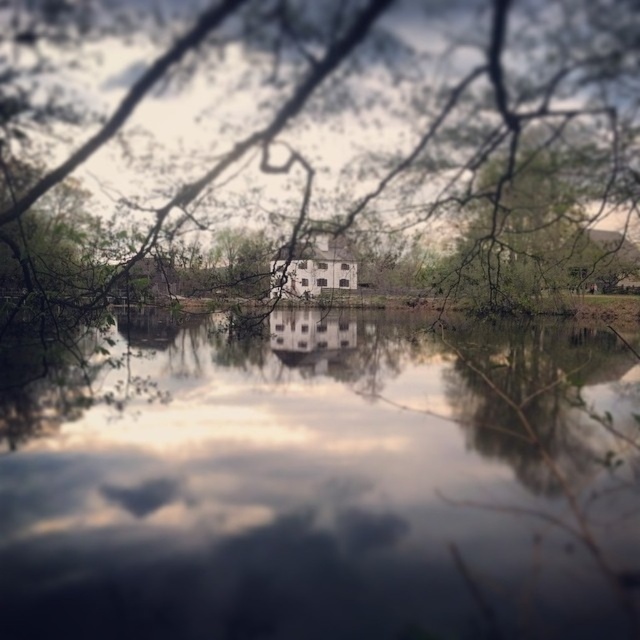
You are standing on the lakeside dock and want to take a photo of the transparent glass water at center and the green leafy branches at center. Which object should you focus on first if you want to capture both in a single frame without moving the camera?

You should focus on the transparent glass water at center first because it is positioned to the left of the green leafy branches at center, so adjusting the focus to the left ensures both objects are in the frame.

Looking at this image, you are standing at the edge of the water and want to place a floating dock that is 15 feet long. The dock needs to be placed from the transparent glass water at center towards the viewer. Is the available space sufficient for the dock?

The distance between the transparent glass water at center and the viewer is 18.45 feet. Since the dock is 15 feet long, it will fit within the available space as 15 feet is less than 18.45 feet.